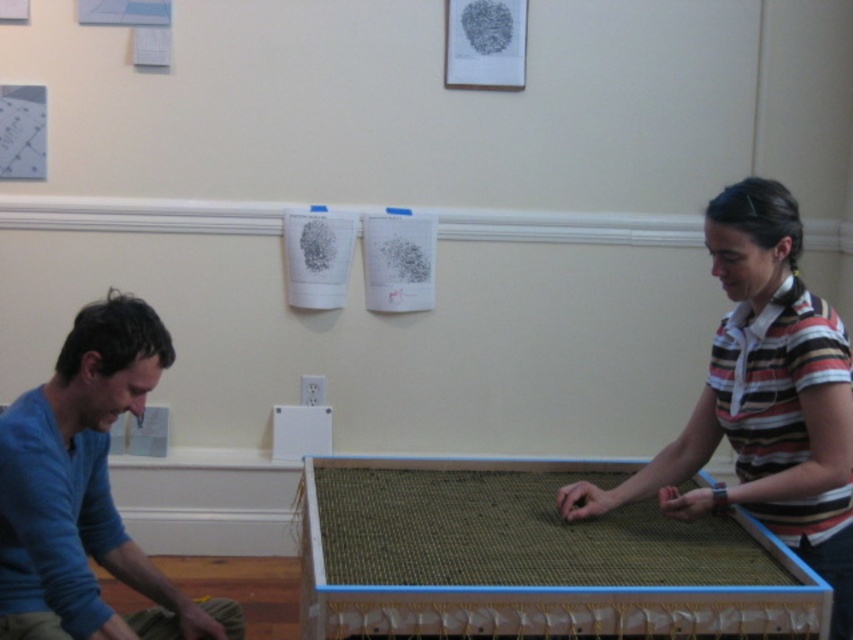
You are standing at the entrance of the room and want to locate the striped cotton shirt at center. According to the coordinates provided, in which direction should you look to find it?

The striped cotton shirt at center is located at coordinates point 0.625 on the x axis and 0.896 on the y axis. Since the x axis runs horizontally from left to right and the y axis vertically from bottom to top, the striped cotton shirt at center is positioned towards the right side and upper part of the room.

You are organizing a clothing donation drive and need to determine which items are suitable for donation. Based on the image, which of the two shirts, the striped cotton shirt at center and the blue cotton shirt at left, is more likely to be in good condition for donation?

The striped cotton shirt at center is larger in size than the blue cotton shirt at left, so it might be more suitable for donation if size is a consideration, but the description does not provide information about their condition.